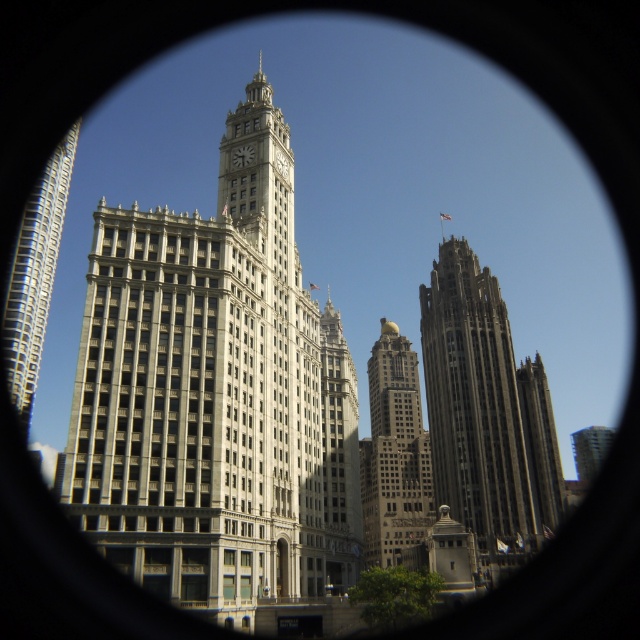
Is silver metallic building at center thinner than dark gray stone tower at right?

No, silver metallic building at center is not thinner than dark gray stone tower at right.

The image size is (640, 640). What do you see at coordinates (216, 396) in the screenshot? I see `silver metallic building at center` at bounding box center [216, 396].

Where is `silver metallic building at center`? The image size is (640, 640). silver metallic building at center is located at coordinates (216, 396).

The height and width of the screenshot is (640, 640). In order to click on silver metallic building at center in this screenshot , I will do `click(216, 396)`.

Is point (381, 337) closer to viewer compared to point (580, 442)?

Yes, point (381, 337) is in front of point (580, 442).

The image size is (640, 640). I want to click on gold polished dome at center, so click(394, 452).

The height and width of the screenshot is (640, 640). I want to click on gold polished dome at center, so click(x=394, y=452).

From the picture: Does silver metallic building at center have a greater height compared to metallic glass skyscraper at center?

Yes, silver metallic building at center is taller than metallic glass skyscraper at center.

Does silver metallic building at center have a lesser height compared to metallic glass skyscraper at center?

In fact, silver metallic building at center may be taller than metallic glass skyscraper at center.

Is point (100, 252) farther from viewer compared to point (605, 445)?

No, it is in front of (605, 445).

The image size is (640, 640). I want to click on silver metallic building at center, so click(x=216, y=396).